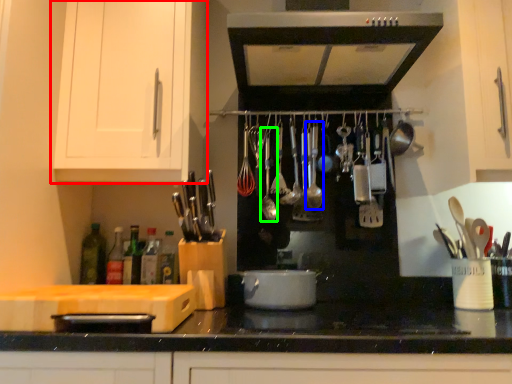
Question: Which object is positioned farthest from cabinetry (highlighted by a red box)? Select from utensil (highlighted by a blue box) and utensil (highlighted by a green box).

Choices:
 (A) utensil
 (B) utensil

Answer: (A)